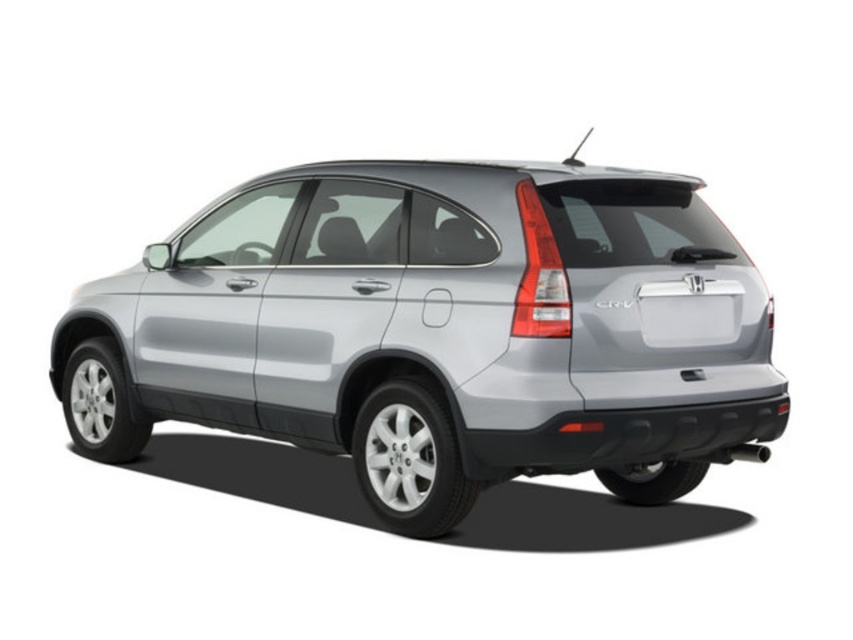
You are a delivery person trying to attach a package to the rear of the satin silver suv at center. The package needs to be placed above the white plastic license plate at rear. Is this possible given their positions?

The satin silver suv at center is located below the white plastic license plate at rear, so placing the package above the white plastic license plate at rear would not be possible since the suv is already positioned below it.

You are a delivery person trying to load a box onto the rear of the satin silver suv at center. The box is 1.2 meters tall. Can you safely place the box on top of the white plastic license plate at rear without it falling off?

The satin silver suv at center is much taller than the white plastic license plate at rear, so the license plate is lower down. The box placed on the license plate might not be stable because the license plate is positioned lower and smaller than the SUV itself. However, the height of the SUV suggests there might be a higher surface like the trunk or rear window where the box could be placed more securely.

You are standing in front of a silver Honda CRV and looking at its rear. You notice two points marked on the car. One is at coordinate point [397,477] and the other is at point [659,326]. Which point is closer to you?

Point [397,477] is further to the camera than point [659,326], so the point closer to you is point [659,326].